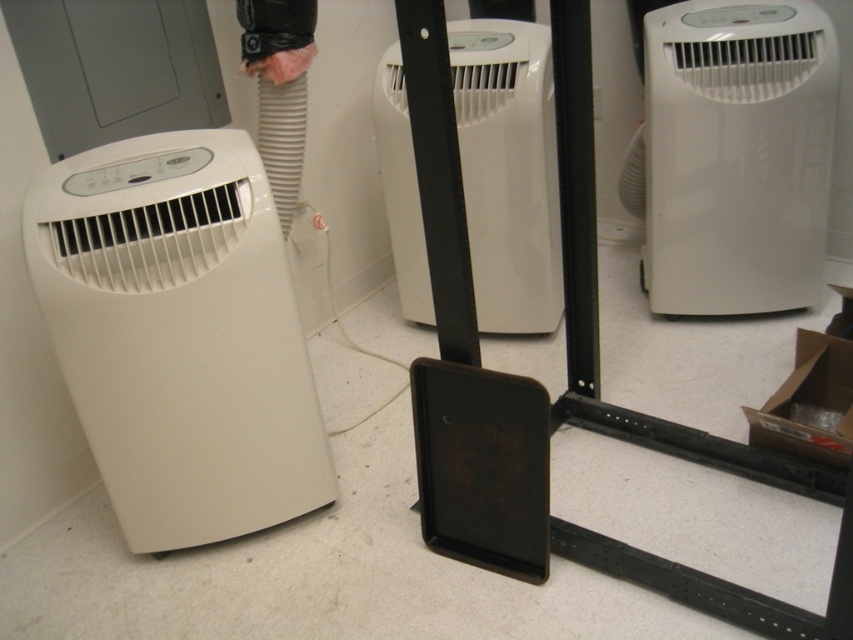
From the picture: Does white matte portable air conditioner at left appear on the left side of white glossy air conditioner at center?

Correct, you'll find white matte portable air conditioner at left to the left of white glossy air conditioner at center.

What do you see at coordinates (178, 336) in the screenshot? I see `white matte portable air conditioner at left` at bounding box center [178, 336].

Is point (181, 136) positioned before point (747, 134)?

Yes, it is.

Where is `white matte portable air conditioner at left`? Image resolution: width=853 pixels, height=640 pixels. white matte portable air conditioner at left is located at coordinates pyautogui.click(x=178, y=336).

What do you see at coordinates (178, 336) in the screenshot? I see `white matte portable air conditioner at left` at bounding box center [178, 336].

In the scene shown: Who is lower down, white matte portable air conditioner at left or white plastic air conditioner at center?

white matte portable air conditioner at left is lower down.

Does point (91, 396) come farther from viewer compared to point (473, 170)?

No, (91, 396) is closer to viewer.

You are a GUI agent. You are given a task and a screenshot of the screen. Output one action in this format:
    pyautogui.click(x=<x>, y=<y>)
    Task: Click on the white matte portable air conditioner at left
    The height and width of the screenshot is (640, 853).
    Given the screenshot: What is the action you would take?
    pyautogui.click(x=178, y=336)

Can you confirm if white glossy air conditioner at center is smaller than white plastic air conditioner at center?

No.

Which is in front, point (706, 81) or point (469, 244)?

Point (706, 81) is more forward.

Is point (755, 97) farther from viewer compared to point (550, 216)?

No, (755, 97) is in front of (550, 216).

The image size is (853, 640). I want to click on white glossy air conditioner at center, so click(737, 154).